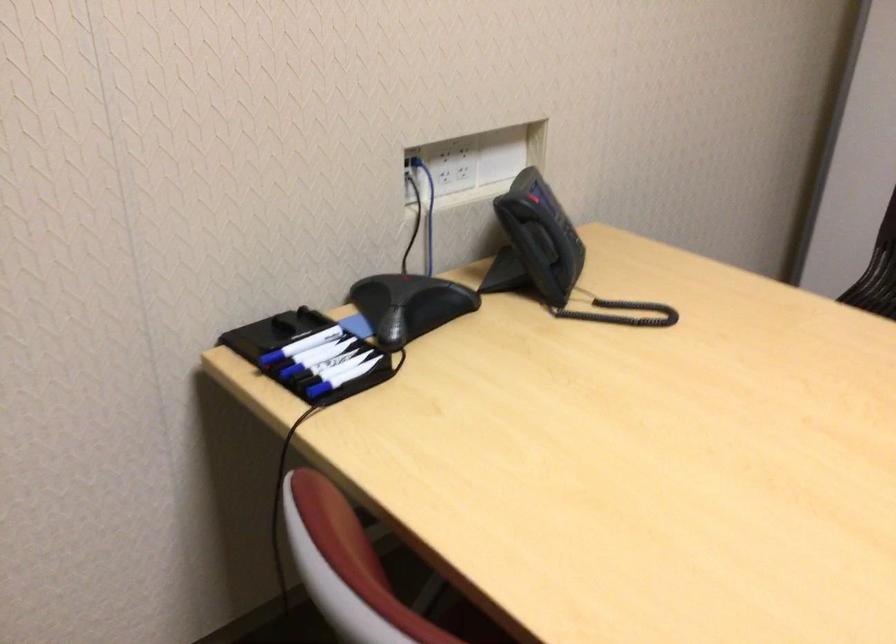
What do you see at coordinates (435, 594) in the screenshot?
I see `a red chair sitting surface` at bounding box center [435, 594].